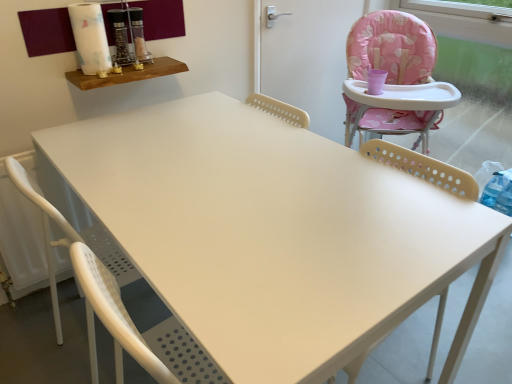
Question: Considering the relative sizes of beige perforated chair at right, arranged as the 2th chair when viewed from the left, and pink fabric screen door at upper right in the image provided, is beige perforated chair at right, arranged as the 2th chair when viewed from the left, bigger than pink fabric screen door at upper right?

Choices:
 (A) yes
 (B) no

Answer: (A)

Question: Does beige perforated chair at right, arranged as the 2th chair when viewed from the left, touch pink fabric screen door at upper right?

Choices:
 (A) no
 (B) yes

Answer: (A)

Question: Considering the relative positions of beige perforated chair at right, which ranks as the first chair in right-to-left order, and pink fabric screen door at upper right in the image provided, is beige perforated chair at right, which ranks as the first chair in right-to-left order, to the left of pink fabric screen door at upper right from the viewer's perspective?

Choices:
 (A) no
 (B) yes

Answer: (B)

Question: From a real-world perspective, is beige perforated chair at right, arranged as the 2th chair when viewed from the left, physically below pink fabric screen door at upper right?

Choices:
 (A) no
 (B) yes

Answer: (B)

Question: From the image's perspective, is beige perforated chair at right, which ranks as the first chair in right-to-left order, beneath pink fabric screen door at upper right?

Choices:
 (A) no
 (B) yes

Answer: (B)

Question: Is beige perforated chair at right, arranged as the 2th chair when viewed from the left, not near pink fabric screen door at upper right?

Choices:
 (A) yes
 (B) no

Answer: (A)

Question: Is white perforated chair at lower left, which is counted as the 1th chair, starting from the left, wider than beige perforated chair at right, which ranks as the first chair in right-to-left order?

Choices:
 (A) no
 (B) yes

Answer: (B)

Question: From the image's perspective, is white perforated chair at lower left, which is counted as the 1th chair, starting from the left, located above beige perforated chair at right, which ranks as the first chair in right-to-left order?

Choices:
 (A) no
 (B) yes

Answer: (B)

Question: Is white perforated chair at lower left, which is counted as the 1th chair, starting from the left, looking in the opposite direction of beige perforated chair at right, arranged as the 2th chair when viewed from the left?

Choices:
 (A) no
 (B) yes

Answer: (A)

Question: Would you consider white perforated chair at lower left, the 2th chair in the right-to-left sequence, to be distant from beige perforated chair at right, which ranks as the first chair in right-to-left order?

Choices:
 (A) yes
 (B) no

Answer: (B)

Question: Considering the relative positions of white perforated chair at lower left, which is counted as the 1th chair, starting from the left, and beige perforated chair at right, which ranks as the first chair in right-to-left order, in the image provided, is white perforated chair at lower left, which is counted as the 1th chair, starting from the left, behind beige perforated chair at right, which ranks as the first chair in right-to-left order,?

Choices:
 (A) yes
 (B) no

Answer: (A)

Question: Does white perforated chair at lower left, the 2th chair in the right-to-left sequence, come in front of beige perforated chair at right, which ranks as the first chair in right-to-left order?

Choices:
 (A) no
 (B) yes

Answer: (A)

Question: From a real-world perspective, is white perforated chair at lower left, which is counted as the 1th chair, starting from the left, physically above wooden shelf at upper left?

Choices:
 (A) yes
 (B) no

Answer: (B)